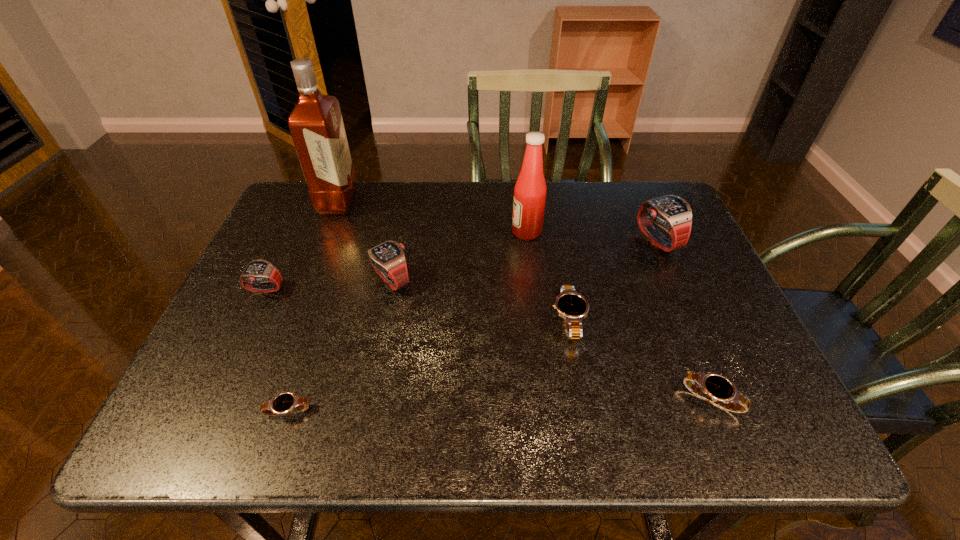
Find the location of a particular element. The height and width of the screenshot is (540, 960). watch at the left edge is located at coordinates (257, 271).

Where is `object that is positioned at the far left corner`? object that is positioned at the far left corner is located at coordinates (316, 125).

The height and width of the screenshot is (540, 960). In order to click on object located at the far right corner in this screenshot , I will do `click(672, 213)`.

In order to click on object at the near right corner in this screenshot , I will do `click(715, 387)`.

Locate an element on the screen. blank space at the far edge of the desktop is located at coordinates (413, 221).

Identify the location of vacant space at the near edge of the desktop. This screenshot has width=960, height=540. (343, 416).

In the image, there is a desktop. Identify the location of vacant space at the right edge. (690, 289).

Identify the location of vacant space at the far left corner of the desktop. The width and height of the screenshot is (960, 540). (307, 216).

This screenshot has width=960, height=540. What are the coordinates of `empty location between the red condiment and the tallest watch` in the screenshot? It's located at (591, 237).

Where is `vacant point located between the sixth shortest object and the liquor`? vacant point located between the sixth shortest object and the liquor is located at coordinates (497, 221).